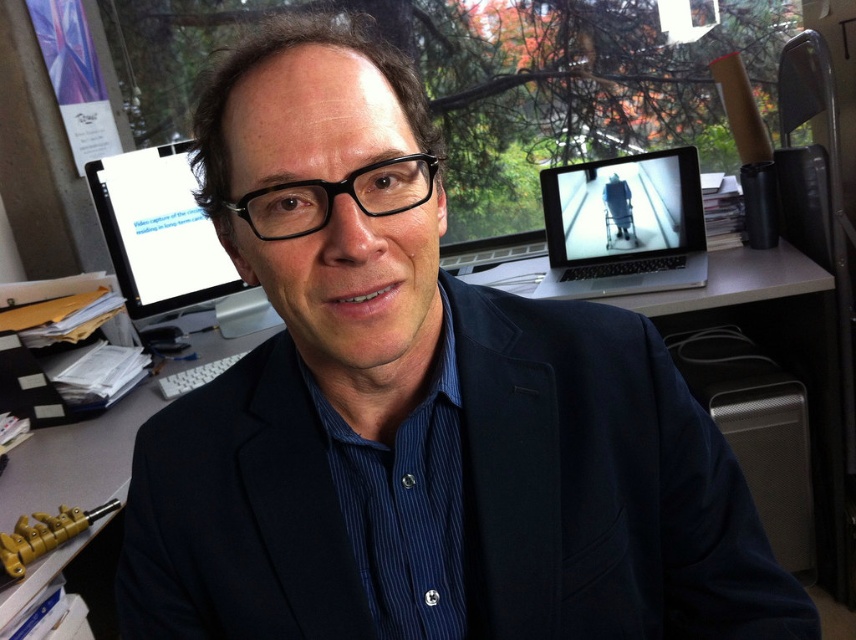
Question: Among these points, which one is farthest from the camera?

Choices:
 (A) (122, 246)
 (B) (403, 620)

Answer: (A)

Question: Considering the relative positions of blue striped dress shirt at center and matte black monitor at upper left in the image provided, where is blue striped dress shirt at center located with respect to matte black monitor at upper left?

Choices:
 (A) below
 (B) above

Answer: (A)

Question: Is blue striped dress shirt at center above matte black monitor at upper left?

Choices:
 (A) no
 (B) yes

Answer: (A)

Question: Can you confirm if blue striped dress shirt at center is positioned to the right of matte black monitor at upper left?

Choices:
 (A) no
 (B) yes

Answer: (B)